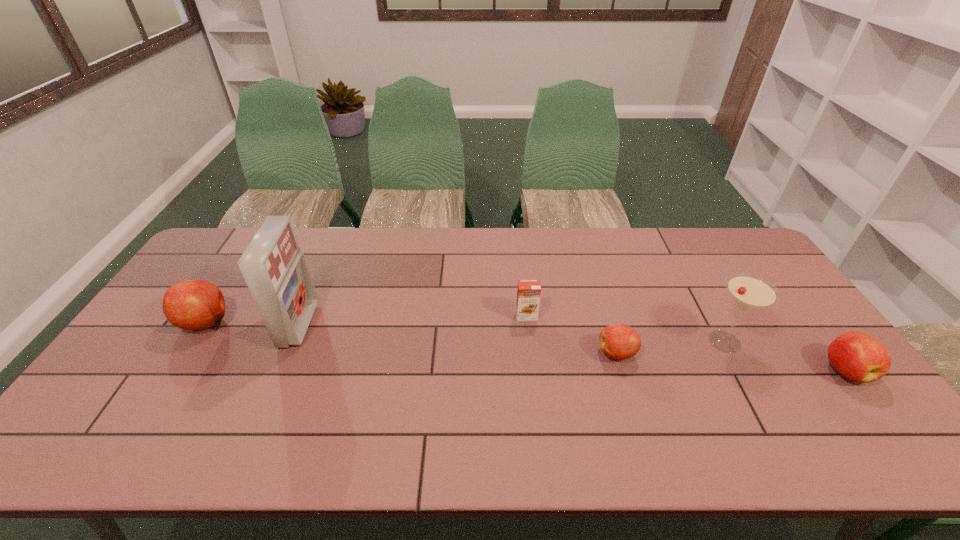
At what (x,y) coordinates should I click in order to perform the action: click on free area in between the leftmost object and the rightmost object. Please return your answer as a coordinate pair (x, y). Looking at the image, I should click on (526, 346).

Image resolution: width=960 pixels, height=540 pixels. In order to click on free area in between the second object from left to right and the second object from right to left in this screenshot , I will do `click(512, 333)`.

Locate an element on the screen. This screenshot has width=960, height=540. free space that is in between the first-aid kit and the third object from left to right is located at coordinates (413, 320).

Find the location of a particular element. The height and width of the screenshot is (540, 960). vacant space in between the third object from right to left and the martini is located at coordinates (671, 347).

Locate an element on the screen. This screenshot has height=540, width=960. object that is the second closest one to the second tallest object is located at coordinates (618, 341).

Identify the location of the fourth closest object relative to the third object from left to right. This screenshot has height=540, width=960. (859, 357).

Locate which apple is the closest to the second apple from right to left. Please provide its 2D coordinates. Your answer should be formatted as a tuple, i.e. [(x, y)], where the tuple contains the x and y coordinates of a point satisfying the conditions above.

[(859, 357)]

Locate which apple is the closest to the shortest apple. Please provide its 2D coordinates. Your answer should be formatted as a tuple, i.e. [(x, y)], where the tuple contains the x and y coordinates of a point satisfying the conditions above.

[(859, 357)]

At what (x,y) coordinates should I click in order to perform the action: click on free space that satisfies the following two spatial constraints: 1. on the front-facing side of the fourth object from left to right; 2. on the right side of the second object from left to right. Please return your answer as a coordinate pair (x, y). Looking at the image, I should click on (287, 353).

This screenshot has width=960, height=540. In order to click on vacant area that satisfies the following two spatial constraints: 1. on the front side of the second object from right to left; 2. on the left side of the leftmost apple in this screenshot , I will do `click(194, 342)`.